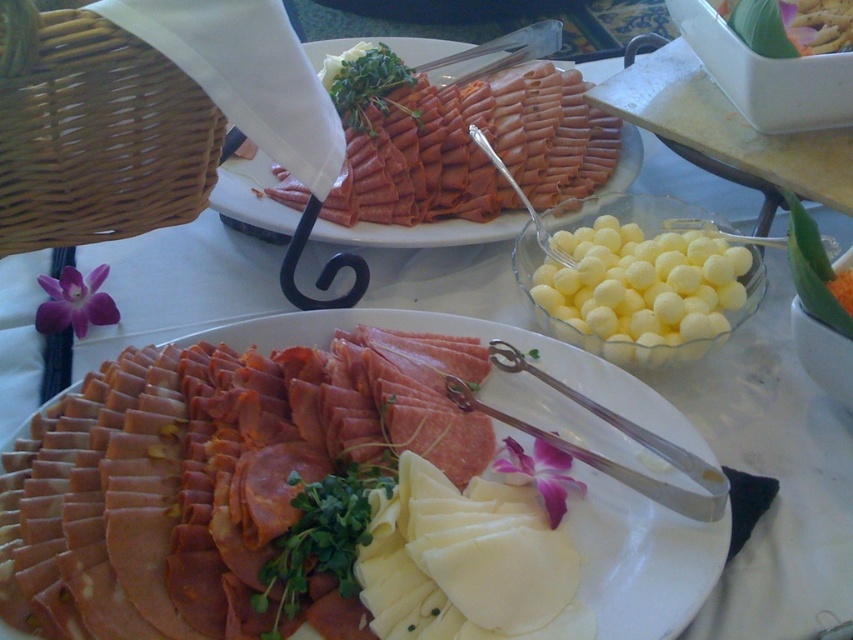
You are holding a small knife that is 15 centimeters long. You want to place it on the table so that it is exactly halfway between you and the point at coordinates point (509, 570). Is this possible?

The distance of point point (509, 570) from viewer is 47.17 centimeters. Half of this distance is 23.585 centimeters. Since the knife is 15 centimeters long, placing it halfway would require it to extend from your position to 23.585 centimeters towards the point. This is feasible as the knife length is shorter than the halfway distance. Therefore, yes, you can place the knife exactly halfway between you and the point point (509, 570).

You are looking at the charcuterie spread and want to identify which of the two points, point (636,385) or point (236,163), is closer to you. Which one is closer?

Point (636,385) is closer to the camera than point (236,163), so it is the closer one.